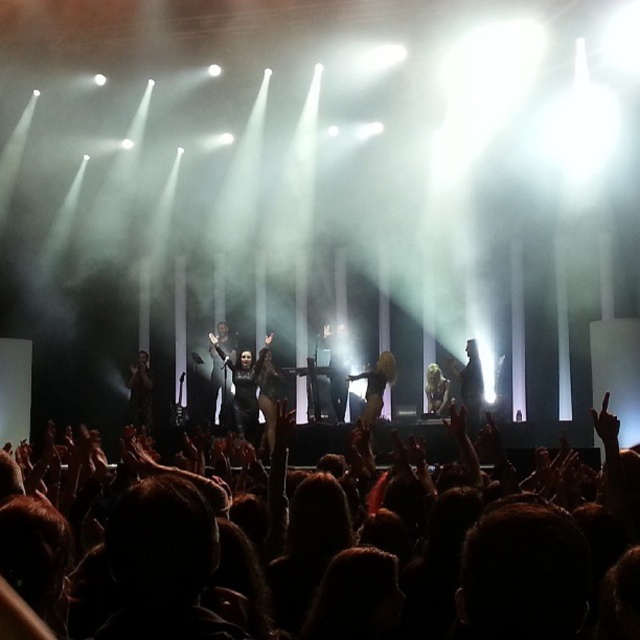
Question: Is silvery metallic jacket at center bigger than satin gold dress at center?

Choices:
 (A) yes
 (B) no

Answer: (B)

Question: Which point is farther from the camera taking this photo?

Choices:
 (A) (365, 388)
 (B) (428, 385)

Answer: (B)

Question: Among these points, which one is farthest from the camera?

Choices:
 (A) (225, 342)
 (B) (392, 364)
 (C) (147, 365)
 (D) (428, 400)

Answer: (C)

Question: Observing the image, what is the correct spatial positioning of matte black dress at center in reference to matte black dress at lower left?

Choices:
 (A) right
 (B) left

Answer: (A)

Question: Among these points, which one is farthest from the camera?

Choices:
 (A) (244, 420)
 (B) (440, 400)
 (C) (218, 410)

Answer: (C)

Question: Does satin gold dress at center appear on the right side of shiny silver dress at center?

Choices:
 (A) yes
 (B) no

Answer: (B)